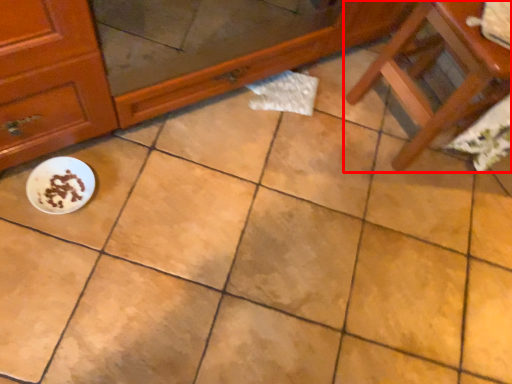
Question: Where is furniture (annotated by the red box) located in relation to meal in the image?

Choices:
 (A) right
 (B) left

Answer: (A)